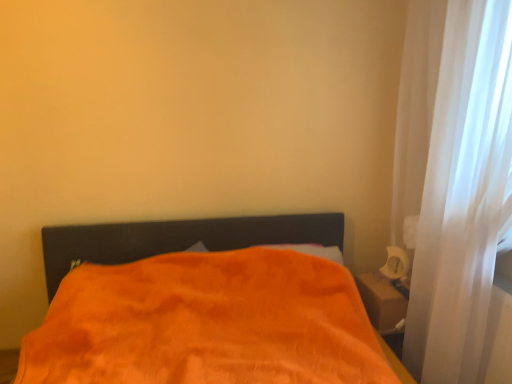
Question: Looking at the image, does white sheer curtain at right seem bigger or smaller compared to orange plush blanket at center?

Choices:
 (A) big
 (B) small

Answer: (B)

Question: From a real-world perspective, relative to orange plush blanket at center, is white sheer curtain at right vertically above or below?

Choices:
 (A) below
 (B) above

Answer: (B)

Question: Considering the real-world distances, which object is closest to the white sheer curtain at right?

Choices:
 (A) white glossy table lamp at right
 (B) orange plush blanket at center

Answer: (A)

Question: Which of these objects is positioned closest to the white sheer curtain at right?

Choices:
 (A) orange plush blanket at center
 (B) white glossy table lamp at right

Answer: (B)